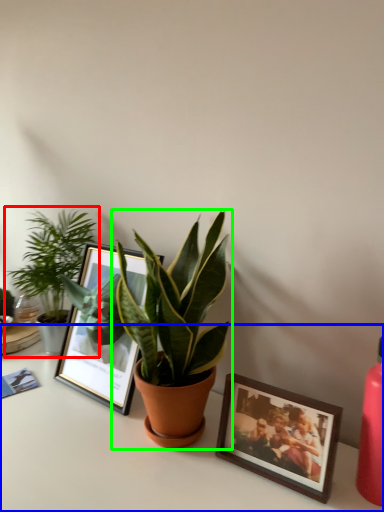
Question: Based on their relative distances, which object is farther from houseplant (highlighted by a red box)? Choose from table (highlighted by a blue box) and houseplant (highlighted by a green box).

Choices:
 (A) table
 (B) houseplant

Answer: (A)